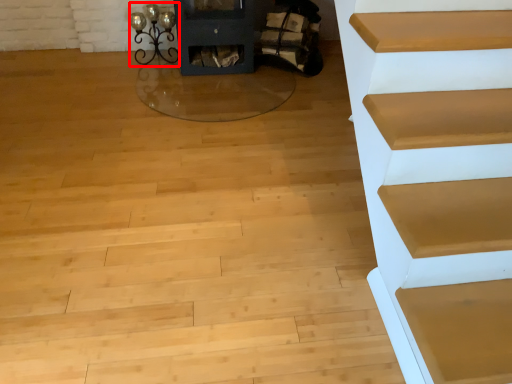
Question: In this image, where is light (annotated by the red box) located relative to chair?

Choices:
 (A) right
 (B) left

Answer: (B)